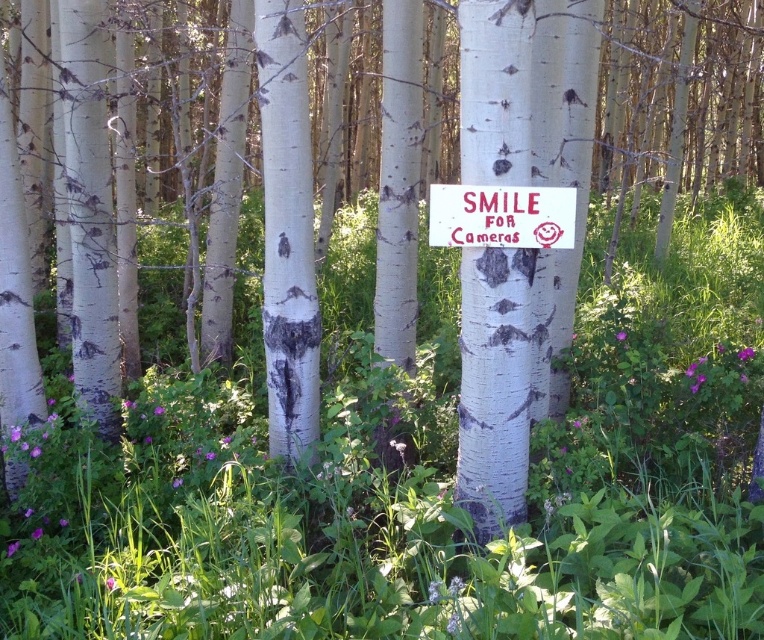
Question: Which of the following is the closest to the observer?

Choices:
 (A) (541, 128)
 (B) (520, 216)

Answer: (B)

Question: Is white bark tree trunk at center in front of white painted wood sign at center?

Choices:
 (A) no
 (B) yes

Answer: (B)

Question: Is white bark tree trunk at center bigger than white painted wood sign at center?

Choices:
 (A) yes
 (B) no

Answer: (A)

Question: Which point is closer to the camera?

Choices:
 (A) (502, 486)
 (B) (510, 221)

Answer: (B)

Question: Which point is farther from the camera taking this photo?

Choices:
 (A) (523, 513)
 (B) (544, 228)

Answer: (A)

Question: Can you confirm if white bark tree trunk at center is bigger than white painted wood sign at center?

Choices:
 (A) yes
 (B) no

Answer: (A)